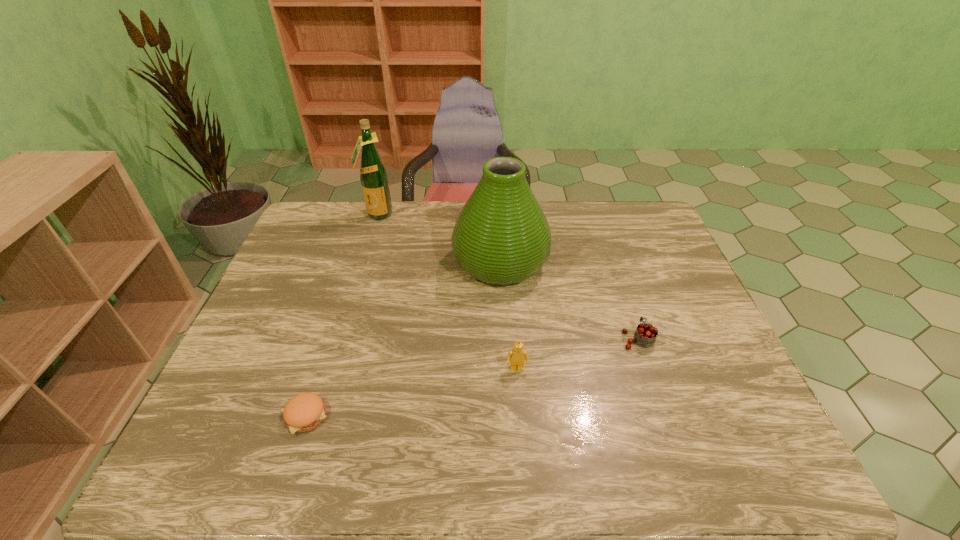
In the image, there is a desktop. Where is `vacant space at the right edge`? This screenshot has height=540, width=960. vacant space at the right edge is located at coordinates [x=675, y=255].

Find the location of `vacant space at the far left corner`. vacant space at the far left corner is located at coordinates (344, 205).

Locate an element on the screen. This screenshot has height=540, width=960. free space at the far right corner of the desktop is located at coordinates (625, 218).

Identify the location of free space that is in between the nearest object and the liquor. Image resolution: width=960 pixels, height=540 pixels. (341, 315).

The height and width of the screenshot is (540, 960). Find the location of `vacant point located between the fourth farthest object and the patty`. vacant point located between the fourth farthest object and the patty is located at coordinates (411, 393).

Find the location of a particular element. This screenshot has height=540, width=960. vacant point located between the cherry and the second farthest object is located at coordinates (x=569, y=301).

Identify the location of free space between the cherry and the patty. This screenshot has height=540, width=960. (471, 377).

Find the location of a particular element. free spot between the fourth farthest object and the farthest object is located at coordinates (446, 292).

You are a GUI agent. You are given a task and a screenshot of the screen. Output one action in this format:
    pyautogui.click(x=<x>, y=<y>)
    Task: Click on the free spot between the fourth tallest object and the vase
    This screenshot has width=960, height=540.
    Given the screenshot: What is the action you would take?
    pyautogui.click(x=569, y=301)

This screenshot has height=540, width=960. I want to click on blank region between the vase and the shortest object, so click(403, 339).